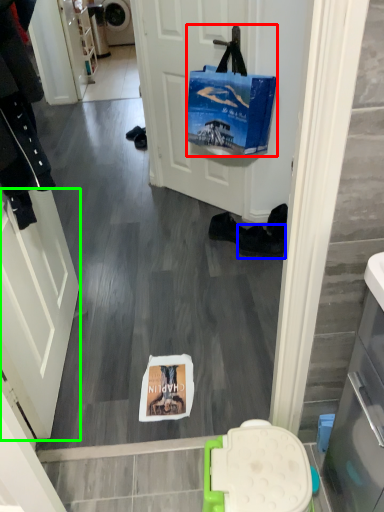
Question: Considering the real-world distances, which object is closest to handbag (highlighted by a red box)? footwear (highlighted by a blue box) or screen door (highlighted by a green box).

Choices:
 (A) footwear
 (B) screen door

Answer: (A)